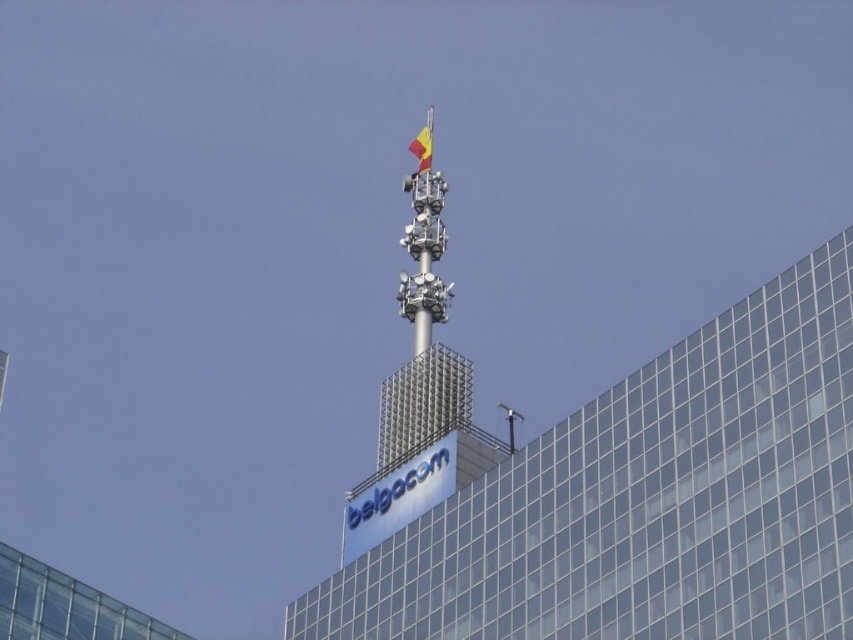
You are a city planner assessing the visibility of the Belgacom logo. The metallic grid spire at upper center and the yellow fabric flag at upper center are both near the logo. Which object is wider and might block more sunlight from reaching the logo?

Result: The metallic grid spire at upper center is wider than the yellow fabric flag at upper center, so it might block more sunlight from reaching the logo.

You are a drone operator who needs to fly a drone between the metallic grid spire at upper center and the yellow fabric flag at upper center. The drone has a height limit of 10 meters. Can you safely fly the drone between them without hitting either structure?

The metallic grid spire at upper center is taller than the yellow fabric flag at upper center. Since the drone has a height limit of 10 meters, you can safely fly it below the metallic grid spire at upper center but must ensure it stays above the yellow fabric flag at upper center to avoid collision. However, without knowing the exact heights of both structures, it is impossible to confirm if the 10 meter limit allows safe passage between them.

You are an architect reviewing a blueprint of the Belgacom building. You notice two points marked on the facade at coordinates point (434, 356) and point (428, 134). Which point is closer to the camera in the blueprint?

Point (434, 356) is closer to the camera than point (428, 134).